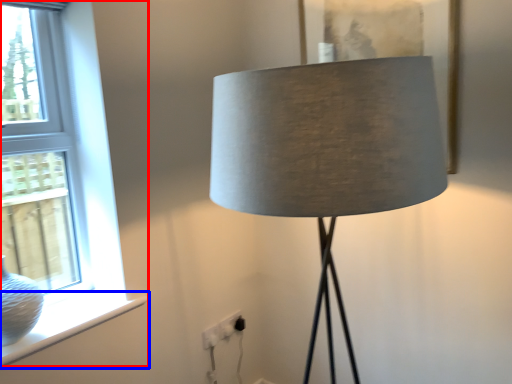
Question: Which of the following is the closest to the observer, window (highlighted by a red box) or window sill (highlighted by a blue box)?

Choices:
 (A) window
 (B) window sill

Answer: (A)